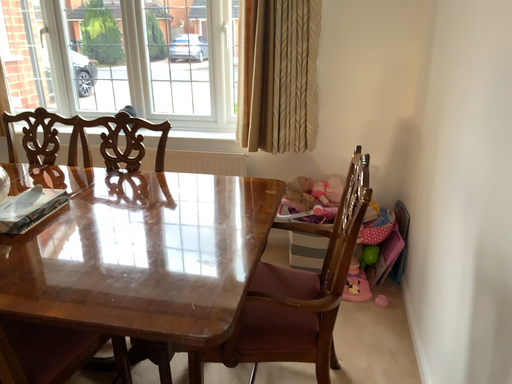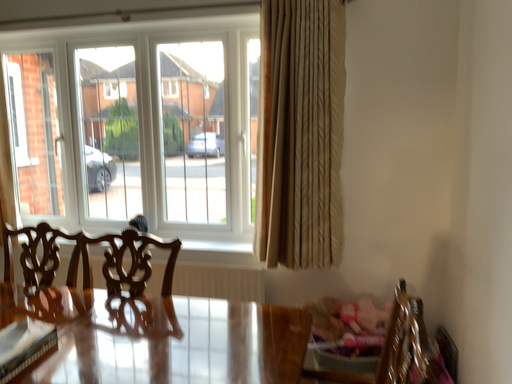
Question: Which way did the camera rotate in the video?

Choices:
 (A) rotated upward
 (B) rotated downward

Answer: (A)